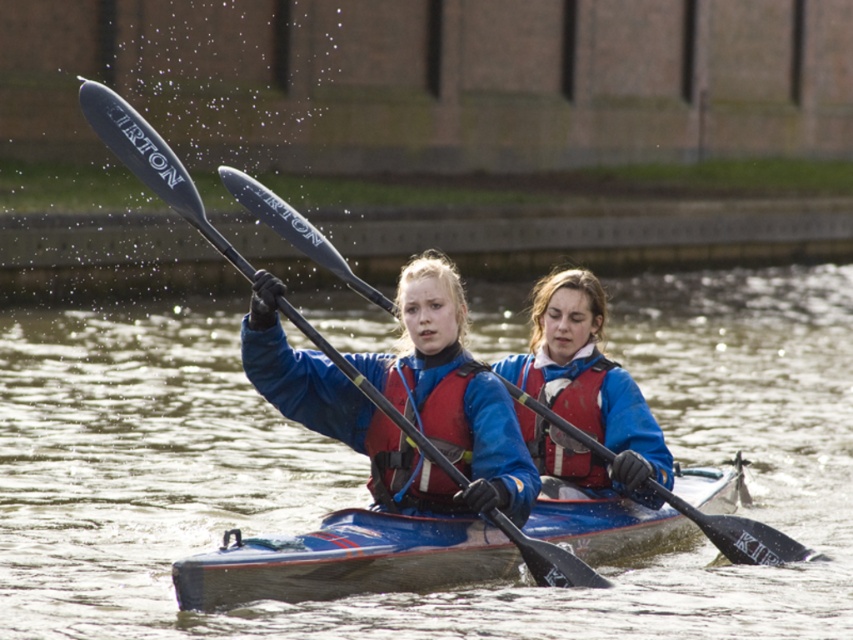
Question: Which object is closer to the camera taking this photo?

Choices:
 (A) red fabric life jacket at center
 (B) matte blue kayak at center

Answer: (B)

Question: Estimate the real-world distances between objects in this image. Which object is closer to the matte black paddle at center?

Choices:
 (A) matte blue kayak at center
 (B) red matte life jacket at center
 (C) black glossy paddle at center
 (D) matte red life vest at center

Answer: (A)

Question: From the image, what is the correct spatial relationship of matte red life vest at center in relation to matte black paddle at center?

Choices:
 (A) right
 (B) left

Answer: (A)

Question: Is blue glossy kayak at center in front of matte blue kayak at center?

Choices:
 (A) no
 (B) yes

Answer: (B)

Question: Observing the image, what is the correct spatial positioning of blue glossy kayak at center in reference to black glossy paddle at center?

Choices:
 (A) left
 (B) right

Answer: (A)

Question: Among these points, which one is farthest from the camera?

Choices:
 (A) (636, 438)
 (B) (479, 369)
 (C) (358, 385)

Answer: (A)